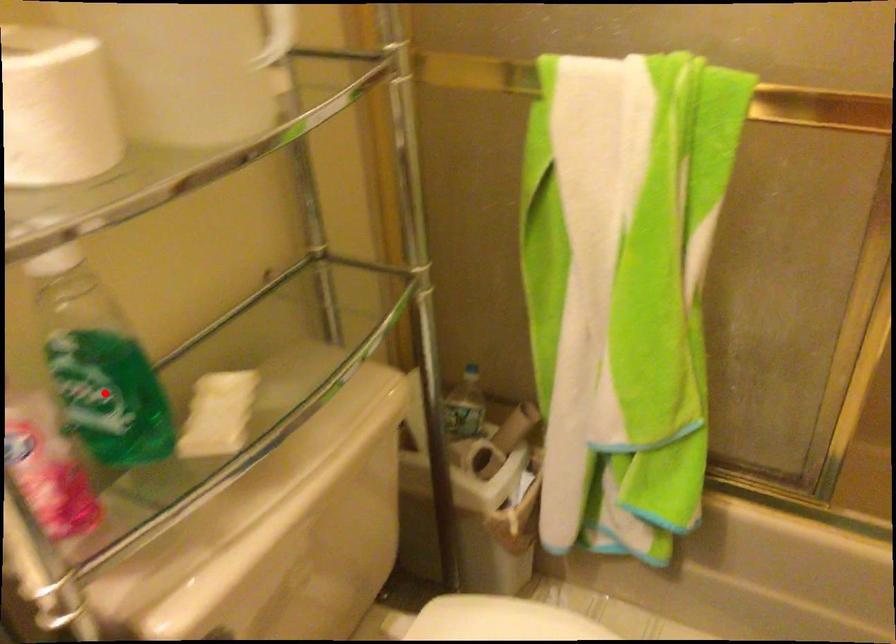
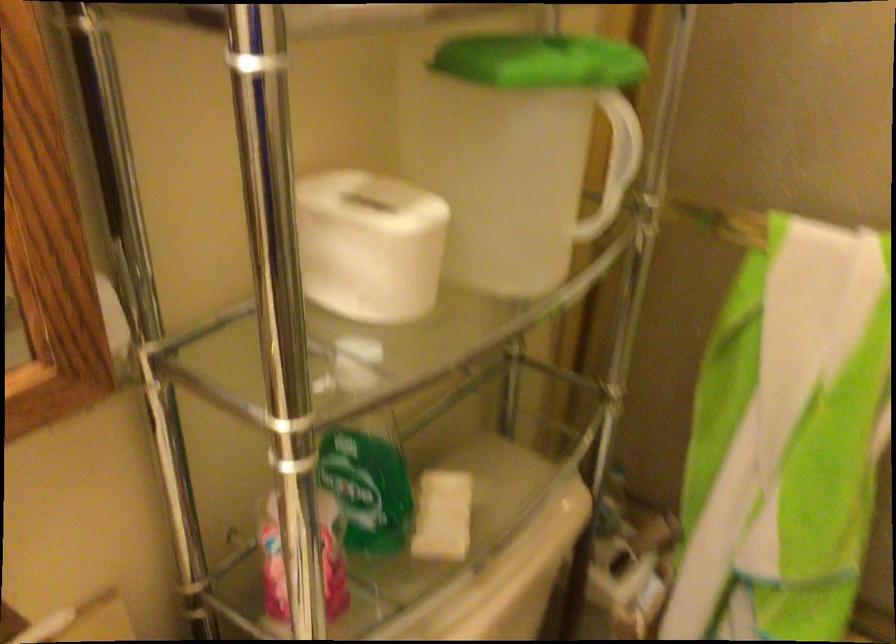
Question: I am providing you with two images of the same scene from different viewpoints. Given a red point in image1, look at the same physical point in image2. Is it:

Choices:
 (A) Closer to the viewpoint
 (B) Farther from the viewpoint

Answer: (B)